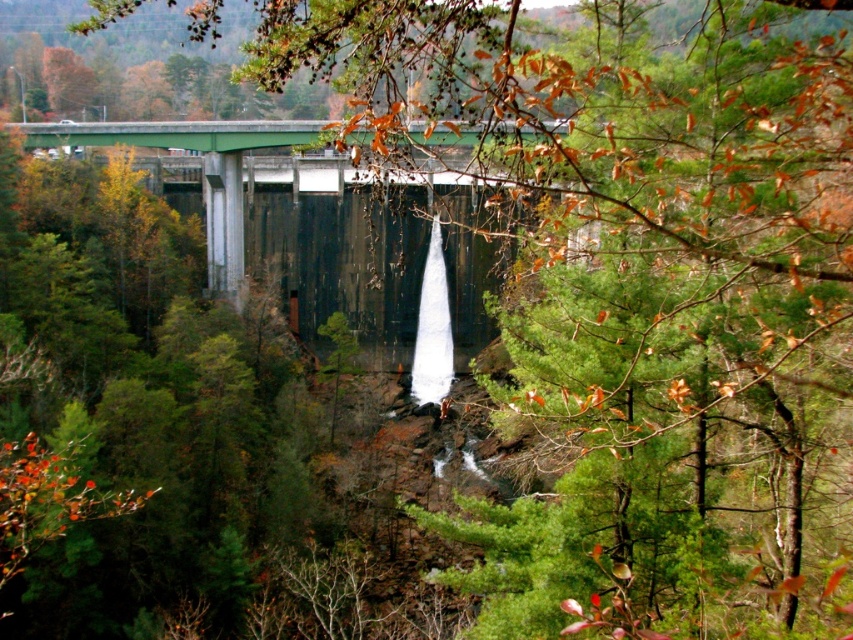
Question: Among these objects, which one is farthest from the camera?

Choices:
 (A) green concrete bridge at center
 (B) white frothy water at center

Answer: (B)

Question: Can you confirm if green concrete bridge at center is positioned to the left of white frothy water at center?

Choices:
 (A) yes
 (B) no

Answer: (A)

Question: Can you confirm if green concrete bridge at center is positioned to the left of white frothy water at center?

Choices:
 (A) no
 (B) yes

Answer: (B)

Question: Which point appears farthest from the camera in this image?

Choices:
 (A) (442, 397)
 (B) (322, 220)

Answer: (B)

Question: Which point is farther to the camera?

Choices:
 (A) green concrete bridge at center
 (B) white frothy water at center

Answer: (B)

Question: Is green concrete bridge at center further to camera compared to white frothy water at center?

Choices:
 (A) yes
 (B) no

Answer: (B)